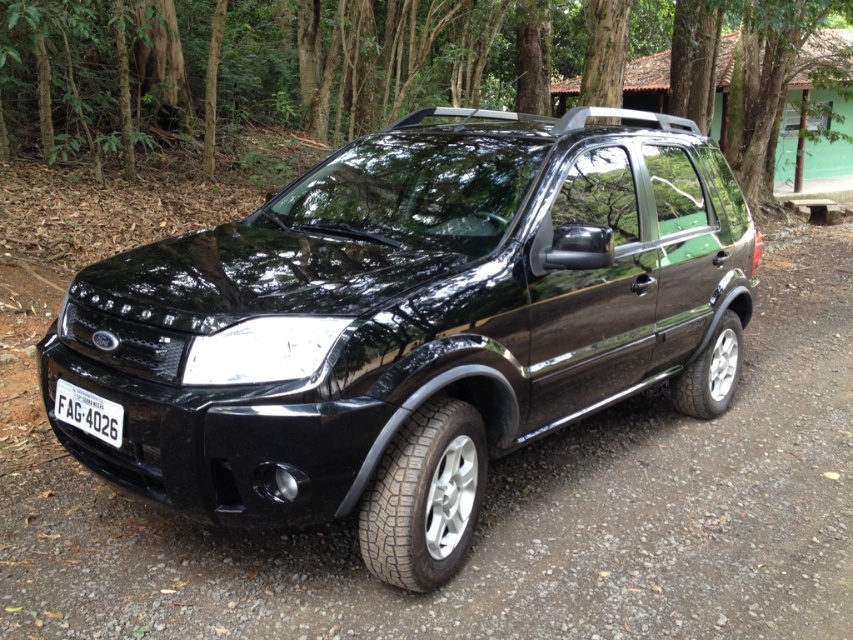
Between glossy black suv at center and black plastic license plate at lower left, which one has less height?

black plastic license plate at lower left is shorter.

Between glossy black suv at center and black plastic license plate at lower left, which one appears on the left side from the viewer's perspective?

From the viewer's perspective, black plastic license plate at lower left appears more on the left side.

Locate an element on the screen. glossy black suv at center is located at coordinates (412, 323).

Who is shorter, green leafy tree at center or black plastic license plate at lower left?

black plastic license plate at lower left

Does point (210, 122) lie in front of point (115, 403)?

No, it is not.

Between point (19, 88) and point (115, 436), which one is positioned in front?

Positioned in front is point (115, 436).

Where is `green leafy tree at center`? green leafy tree at center is located at coordinates (367, 65).

Which is more to the left, glossy black suv at center or green leafy tree at center?

glossy black suv at center

Can you confirm if glossy black suv at center is positioned to the left of green leafy tree at center?

Correct, you'll find glossy black suv at center to the left of green leafy tree at center.

The width and height of the screenshot is (853, 640). Describe the element at coordinates (412, 323) in the screenshot. I see `glossy black suv at center` at that location.

Find the location of `glossy black suv at center`. glossy black suv at center is located at coordinates (412, 323).